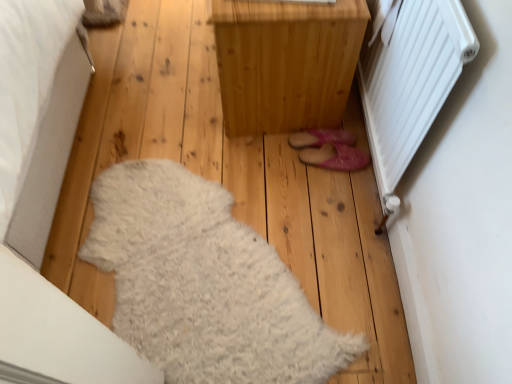
In order to click on free point in front of natural wood cabinet at center in this screenshot , I will do `click(234, 182)`.